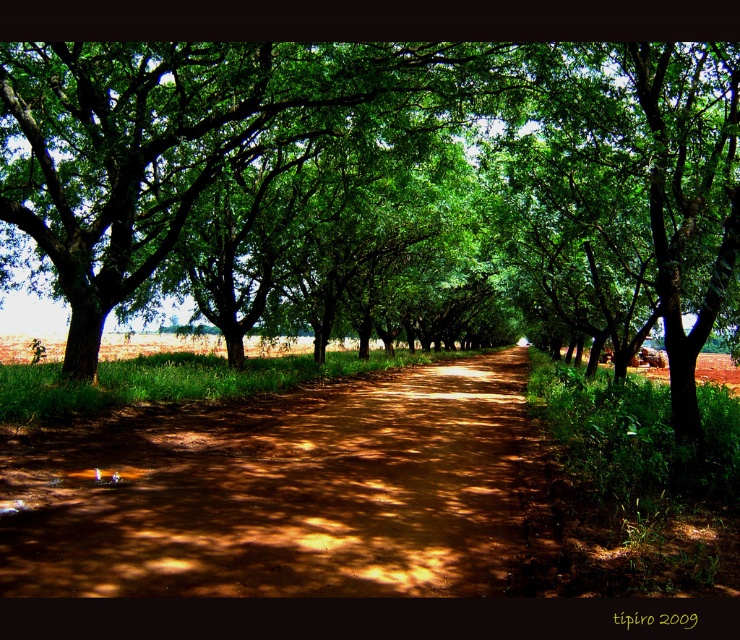
You are a hiker planning to walk along the dirt path in this rural scene. You notice the green leafy tree at center and the brown dirt track at center. Which object is bigger in size?

The green leafy tree at center is larger in size compared to the brown dirt track at center, so the green leafy tree at center is bigger.

You are standing at the starting point of the dirt path in the rural scene. If you walk straight ahead along the path, which direction will the green leafy tree at center be relative to your path? Please answer with either left, right, front, or behind.

The green leafy tree at center is located at point (380, 186) in 2D coordinates. Since the dirt path is straight and the tree is at the center, it will be directly in front of you as you walk along the path.

You are a hiker standing at the start of the dirt path and want to know which object is taller between the green leafy tree at center and the brown dirt track at center. Which one is taller?

The green leafy tree at center is taller than the brown dirt track at center.